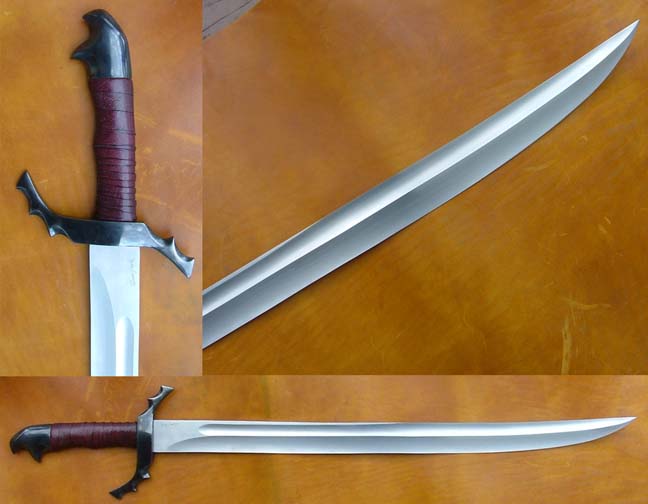
Locate an element on the screen. This screenshot has height=504, width=648. surface is located at coordinates (45, 327).